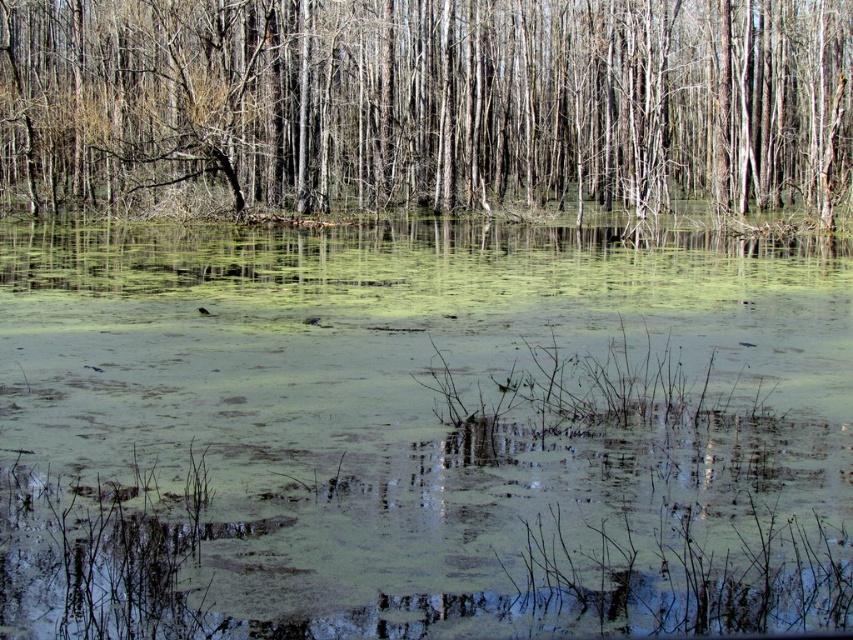
Question: Is green algae water at center positioned behind smooth bark tree at center?

Choices:
 (A) no
 (B) yes

Answer: (A)

Question: Among these points, which one is nearest to the camera?

Choices:
 (A) (15, 552)
 (B) (39, 100)

Answer: (A)

Question: Does green algae water at center appear under smooth bark tree at center?

Choices:
 (A) yes
 (B) no

Answer: (A)

Question: Among these points, which one is nearest to the camera?

Choices:
 (A) (456, 307)
 (B) (271, 32)

Answer: (A)

Question: Does green algae water at center have a smaller size compared to smooth bark tree at center?

Choices:
 (A) no
 (B) yes

Answer: (B)